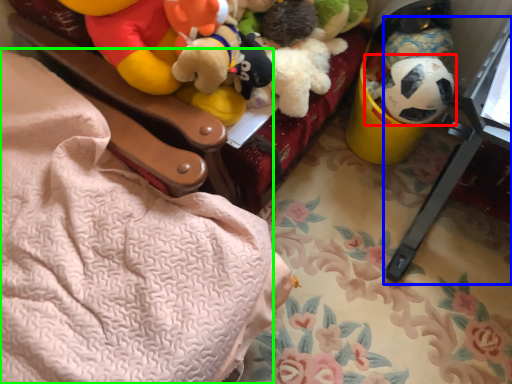
Question: Estimate the real-world distances between objects in this image. Which object is closer to toy (highlighted by a red box), changing table (highlighted by a blue box) or blanket (highlighted by a green box)?

Choices:
 (A) changing table
 (B) blanket

Answer: (A)